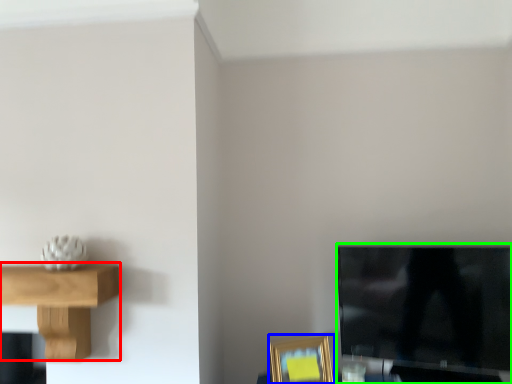
Question: Which object is positioned farthest from shelf (highlighted by a red box)? Select from picture frame (highlighted by a blue box) and television (highlighted by a green box).

Choices:
 (A) picture frame
 (B) television

Answer: (B)